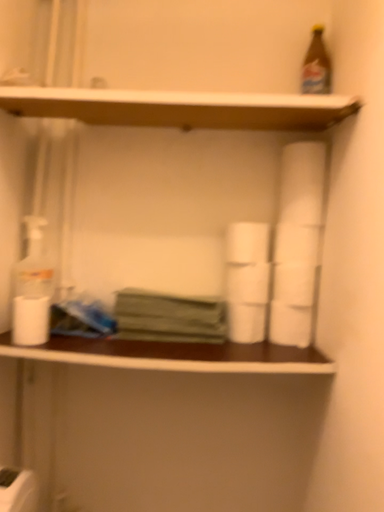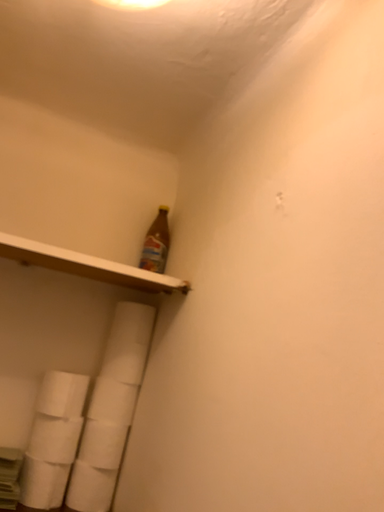
Question: Which way did the camera rotate in the video?

Choices:
 (A) rotated left
 (B) rotated right

Answer: (B)